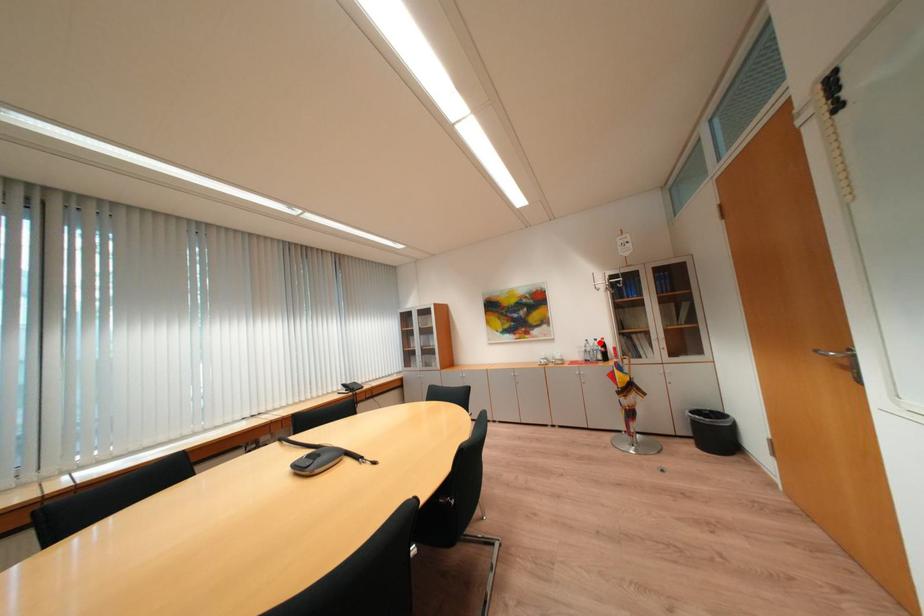
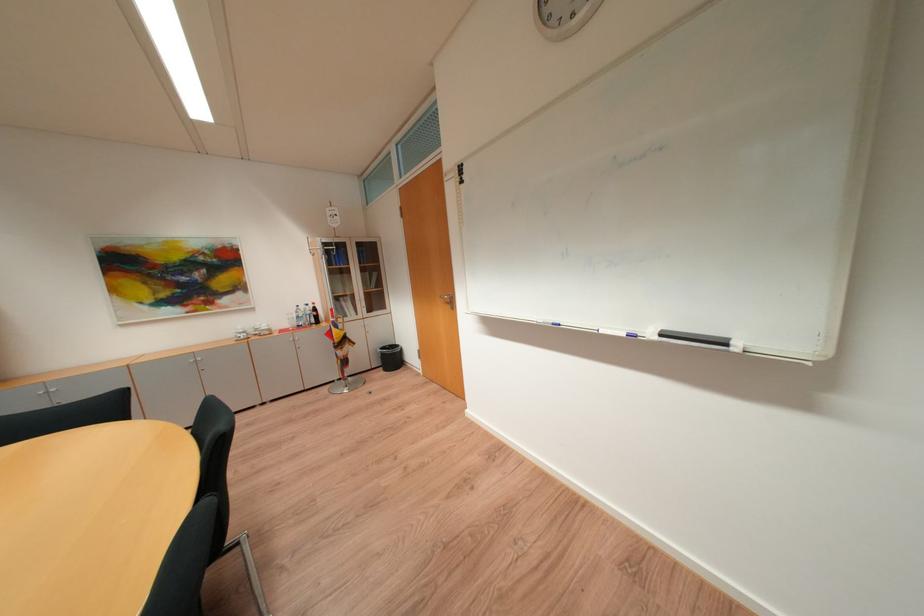
In the second image, find the point that corresponds to the highlighted location in the first image.

(310, 309)